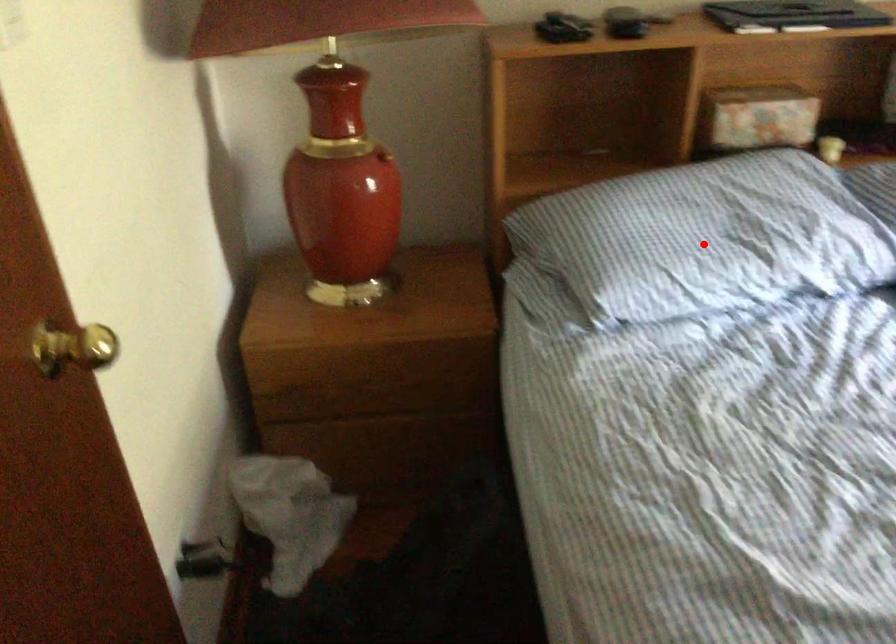
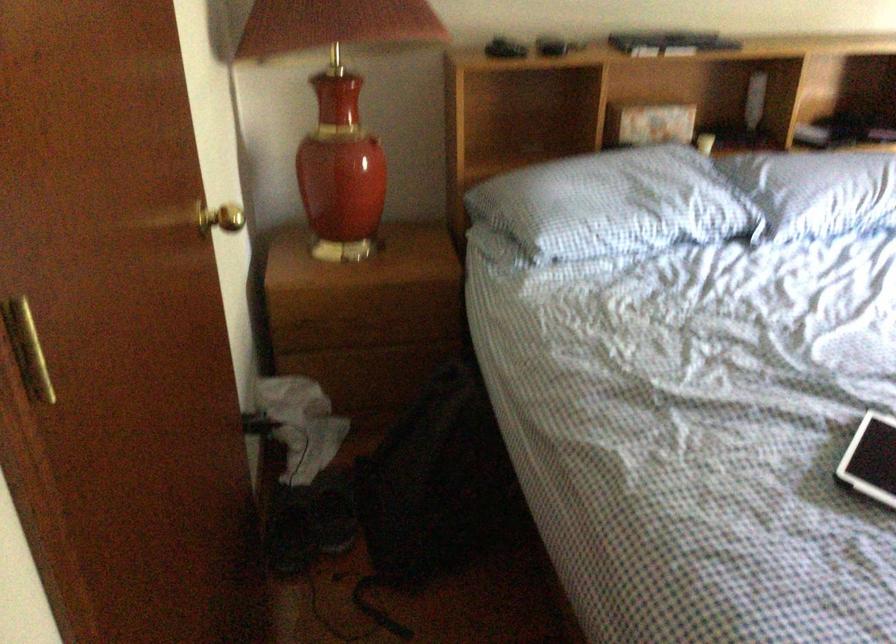
Question: I am providing you with two images of the same scene from different viewpoints. Image1 has a red point marked. In image2, the corresponding 3D location appears at what relative position? Reply with the corresponding letter.

Choices:
 (A) Closer
 (B) Farther

Answer: (B)